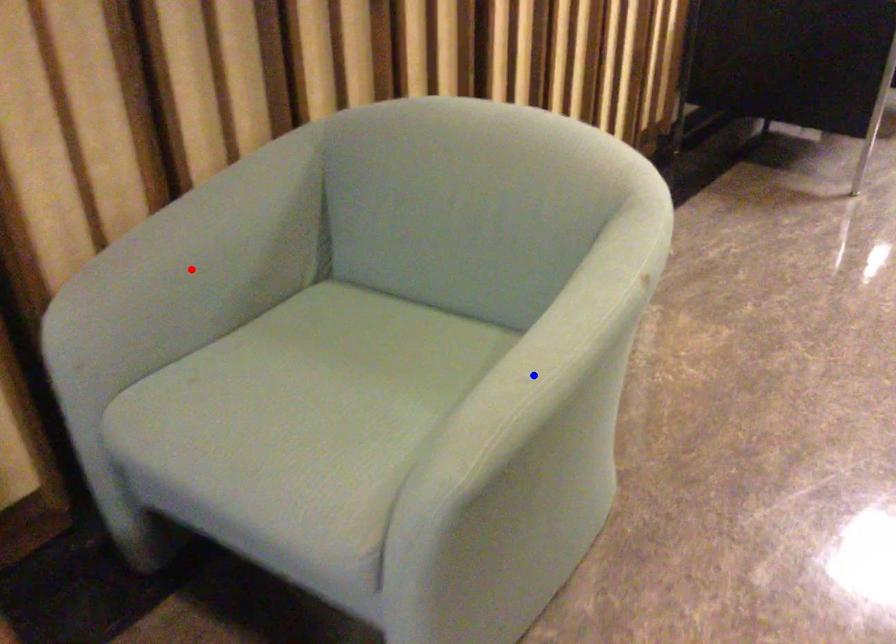
Question: Two points are marked on the image. Which point is closer to the camera?

Choices:
 (A) Blue point is closer.
 (B) Red point is closer.

Answer: (A)